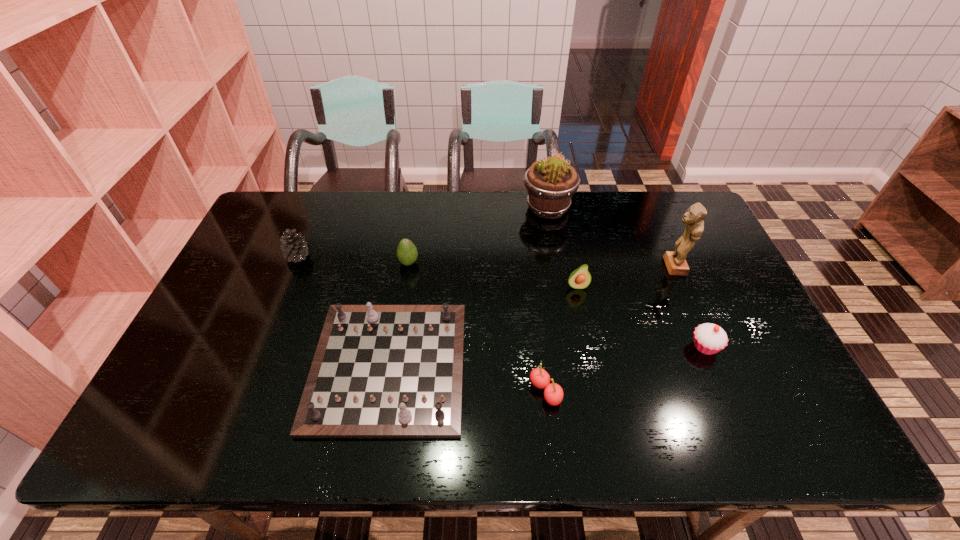
This screenshot has height=540, width=960. What are the coordinates of `free space between the pinecone and the nearer avocado` in the screenshot? It's located at (438, 271).

Locate an element on the screen. Image resolution: width=960 pixels, height=540 pixels. free space between the chessboard and the farthest object is located at coordinates (468, 287).

Identify the location of free space that is in between the flowerpot and the left avocado. (478, 235).

Where is `vacant space that is in between the left avocado and the fifth farthest object`? Image resolution: width=960 pixels, height=540 pixels. vacant space that is in between the left avocado and the fifth farthest object is located at coordinates (492, 274).

The image size is (960, 540). What are the coordinates of `empty space between the right avocado and the cupcake` in the screenshot? It's located at (641, 316).

Identify the location of vacant space that is in between the cupcake and the fifth farthest object. (641, 316).

The image size is (960, 540). In order to click on blank region between the flowerpot and the cupcake in this screenshot , I will do `click(626, 278)`.

Identify the location of object that is the seventh closest to the cherry. (294, 246).

This screenshot has height=540, width=960. Identify the location of object that is the sixth closest to the chessboard. (709, 338).

In order to click on vacant region that satisfies the following two spatial constraints: 1. on the cut side of the nearer avocado; 2. on the left side of the cupcake in this screenshot , I will do `click(589, 347)`.